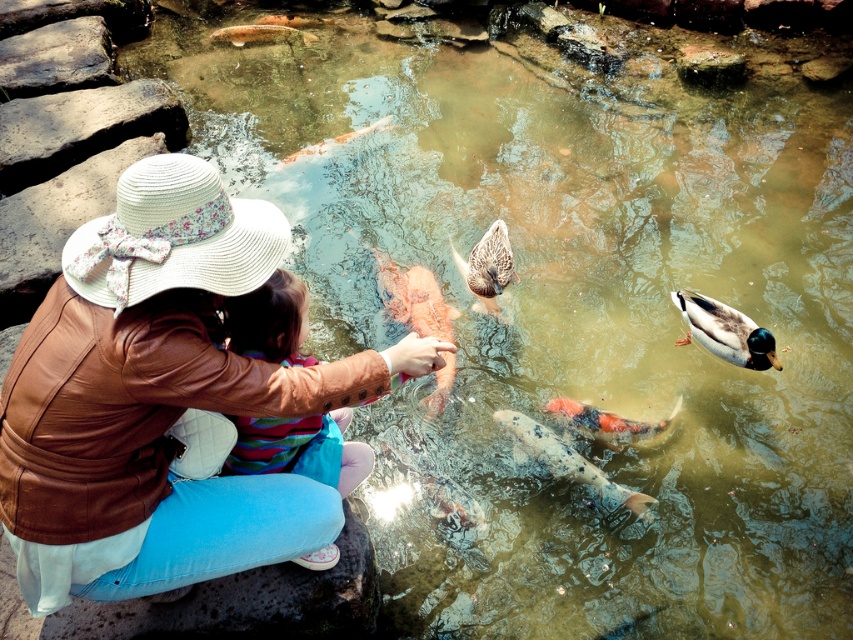
Which of these two, speckled orange fish at center or shiny orange fish at center, stands shorter?

With less height is shiny orange fish at center.

Does point (575, 467) come behind point (677, 404)?

No, it is in front of (677, 404).

The height and width of the screenshot is (640, 853). What are the coordinates of `speckled orange fish at center` in the screenshot? It's located at (569, 461).

Does point (482, 243) come farther from viewer compared to point (271, 29)?

That is False.

This screenshot has width=853, height=640. I want to click on brown feathered duck at center, so click(x=486, y=268).

Is point (440, 396) closer to viewer compared to point (630, 502)?

No, (440, 396) is further to viewer.

Who is more forward, (392,298) or (602,486)?

Positioned in front is point (602,486).

The image size is (853, 640). Find the location of `orange textured fish at center`. orange textured fish at center is located at coordinates (415, 298).